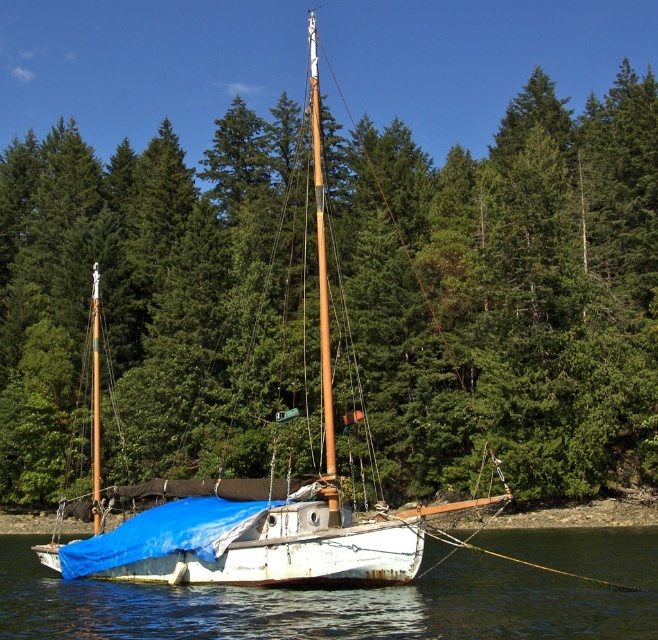
You are standing on the deck of the sailboat and looking at two points marked on the boat. The first point is at coordinate point(557, 628) and the second point is at point(253, 577). Which point is closer to you?

Point(557, 628) is closer to the camera than point(253, 577), so the first point is closer to you.

You are standing on the white tarpaulin sailboat at center and want to move to the white matte water at center. Which direction should you go?

The white matte water at center is positioned on the right side of the white tarpaulin sailboat at center, so you should move to the right to reach it.

You are standing on the forested shoreline looking out at the small sailboat. There is a point marked at coordinates (361, 596). Based on the scene, where is this point located?

The point is located on the white matte water at center.